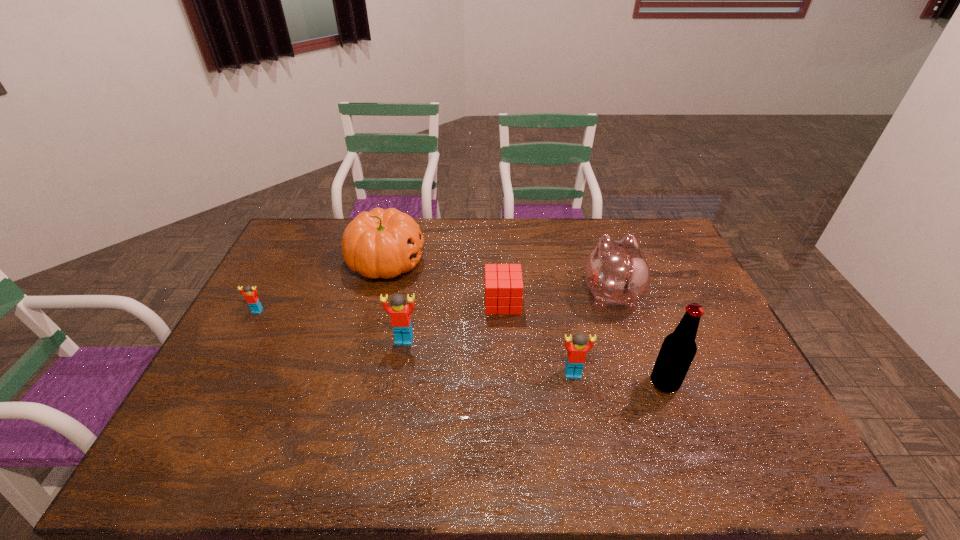
Locate an element on the screen. The height and width of the screenshot is (540, 960). free spot that satisfies the following two spatial constraints: 1. on the face of the beer bottle; 2. on the left side of the shortest Lego is located at coordinates (219, 383).

Where is `free point that satisfies the following two spatial constraints: 1. on the back side of the beer bottle; 2. on the carved face of the pumpkin`? The height and width of the screenshot is (540, 960). free point that satisfies the following two spatial constraints: 1. on the back side of the beer bottle; 2. on the carved face of the pumpkin is located at coordinates (618, 262).

The width and height of the screenshot is (960, 540). Find the location of `free space that satisfies the following two spatial constraints: 1. on the front facing side of the piggy bank; 2. on the carved face of the pumpkin`. free space that satisfies the following two spatial constraints: 1. on the front facing side of the piggy bank; 2. on the carved face of the pumpkin is located at coordinates (600, 262).